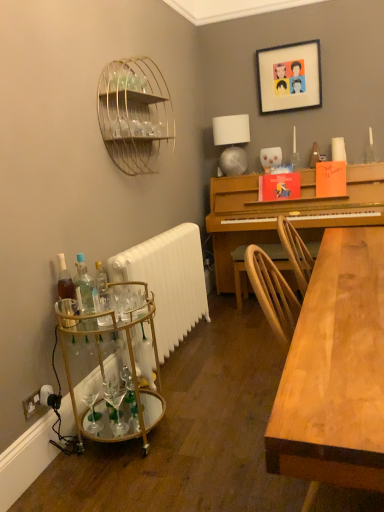
Question: From the image's perspective, is white matte radiator at lower left below wooden picture frame at upper center?

Choices:
 (A) no
 (B) yes

Answer: (B)

Question: Is white matte radiator at lower left not inside wooden picture frame at upper center?

Choices:
 (A) no
 (B) yes

Answer: (B)

Question: Is white matte radiator at lower left aimed at wooden picture frame at upper center?

Choices:
 (A) yes
 (B) no

Answer: (B)

Question: Is white matte radiator at lower left turned away from wooden picture frame at upper center?

Choices:
 (A) no
 (B) yes

Answer: (A)

Question: Considering the relative sizes of white matte radiator at lower left and wooden picture frame at upper center in the image provided, is white matte radiator at lower left bigger than wooden picture frame at upper center?

Choices:
 (A) yes
 (B) no

Answer: (A)

Question: Considering the relative positions of white matte radiator at lower left and wooden picture frame at upper center in the image provided, is white matte radiator at lower left behind wooden picture frame at upper center?

Choices:
 (A) yes
 (B) no

Answer: (B)

Question: Does translucent glass bottles at lower left, placed as the second bottle when sorted from left to right, appear on the right side of translucent glass bottle at lower left, the 3th bottle when ordered from right to left?

Choices:
 (A) yes
 (B) no

Answer: (A)

Question: Can you confirm if translucent glass bottles at lower left, arranged as the second bottle when viewed from the right, is taller than translucent glass bottle at lower left, the 3th bottle when ordered from right to left?

Choices:
 (A) yes
 (B) no

Answer: (A)

Question: Does translucent glass bottles at lower left, arranged as the second bottle when viewed from the right, come in front of translucent glass bottle at lower left, the 3th bottle when ordered from right to left?

Choices:
 (A) yes
 (B) no

Answer: (A)

Question: From a real-world perspective, is translucent glass bottles at lower left, placed as the second bottle when sorted from left to right, positioned under translucent glass bottle at lower left, the 3th bottle when ordered from right to left, based on gravity?

Choices:
 (A) no
 (B) yes

Answer: (A)

Question: From the image's perspective, is translucent glass bottles at lower left, arranged as the second bottle when viewed from the right, above translucent glass bottle at lower left, the 3th bottle when ordered from right to left?

Choices:
 (A) yes
 (B) no

Answer: (B)

Question: Does translucent glass bottles at lower left, placed as the second bottle when sorted from left to right, appear on the left side of translucent glass bottle at lower left, acting as the first bottle starting from the left?

Choices:
 (A) yes
 (B) no

Answer: (B)

Question: Is the depth of satin silver lampshade at upper right greater than that of clear glass bottle at left, which ranks as the 3th bottle in left-to-right order?

Choices:
 (A) yes
 (B) no

Answer: (A)